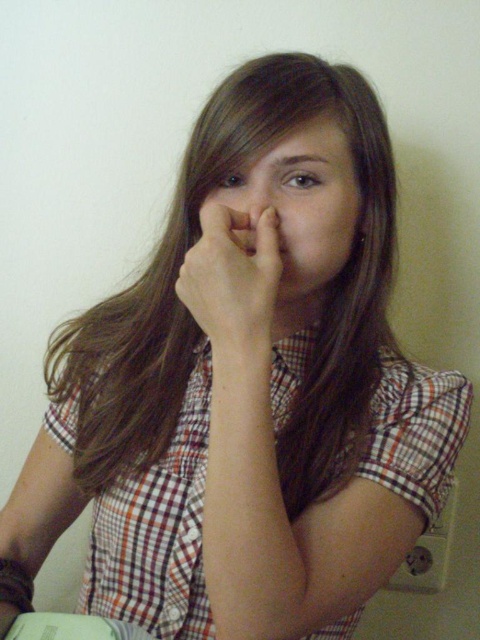
You are standing in the room where the person is seated. You want to place a 24 inch ruler on the floor between you and the point at coordinates point (120,547). Will the ruler fit entirely within that distance?

The distance between you and the point (120,547) is 26.73 inches. Since the ruler is 24 inches long, it will fit entirely within that distance because 24 is less than 26.73.

The person is wearing a plaid cotton shirt at center and has a matte skin nose at center. Which of these two items is wider?

The plaid cotton shirt at center is wider than the matte skin nose at center.